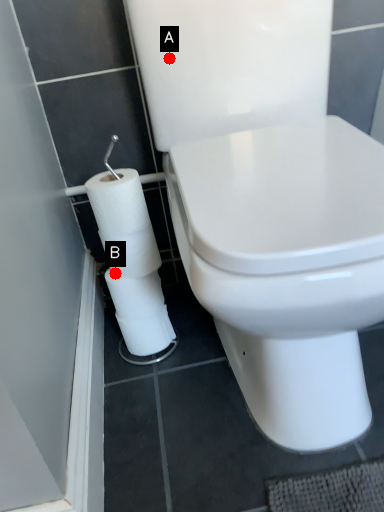
Question: Two points are circled on the image, labeled by A and B beside each circle. Among these points, which one is nearest to the camera?

Choices:
 (A) A is closer
 (B) B is closer

Answer: (A)